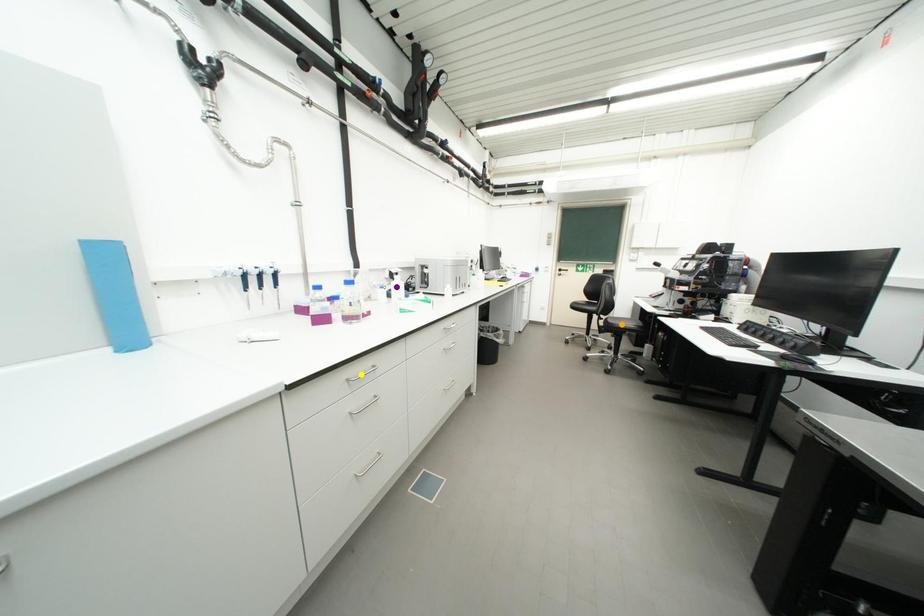
Consider the image. Order these from nearest to farthest:
orange point | purple point | yellow point

yellow point
purple point
orange point